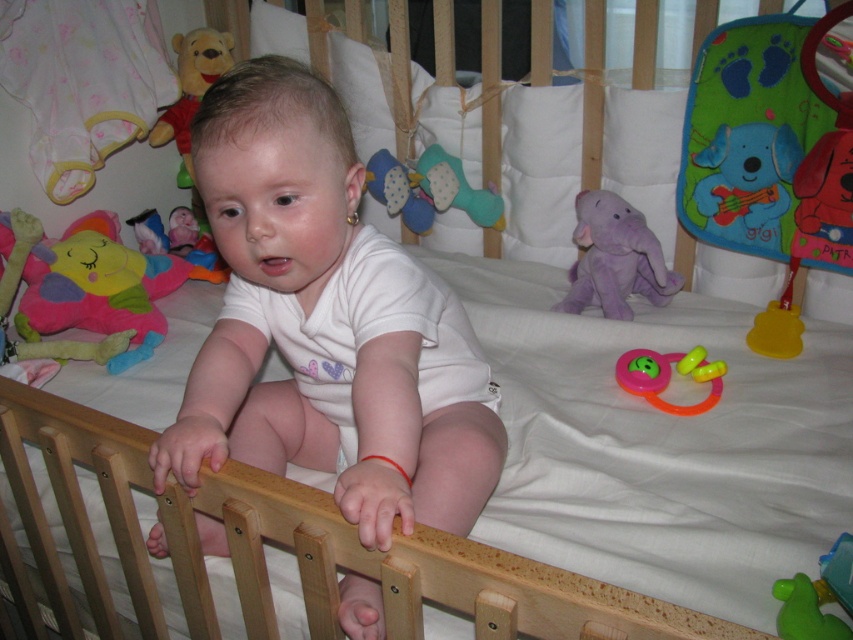
You are a parent trying to place a new toy in the crib for the baby. The crib has two specific points marked as point 1 at coordinates point (787, 163) and point 2 at coordinates point (354, 221). Which point is closer to the baby so the baby can easily reach it?

Point (787, 163) is closer to the baby because it is further to the viewer than point (354, 221), meaning it is physically nearer to the baby in the crib.

You are a parent checking the safety of the baby crib. You notice the purple plush elephant at upper center and the blue plush teething toy at center. Which toy is taller?

The purple plush elephant at upper center is taller than the blue plush teething toy at center.

You are a parent checking the safety of the baby crib. You notice the green plush toy at upper right and the rubber teething ring at center. Which object is taller?

The green plush toy at upper right is taller than the rubber teething ring at center.